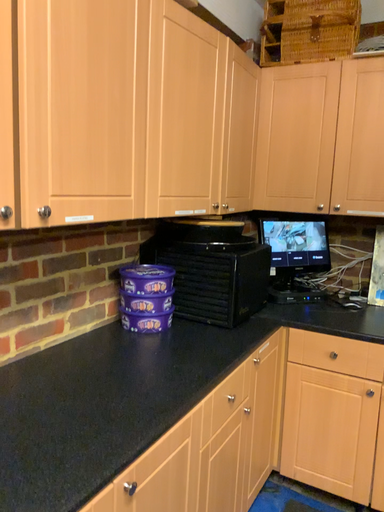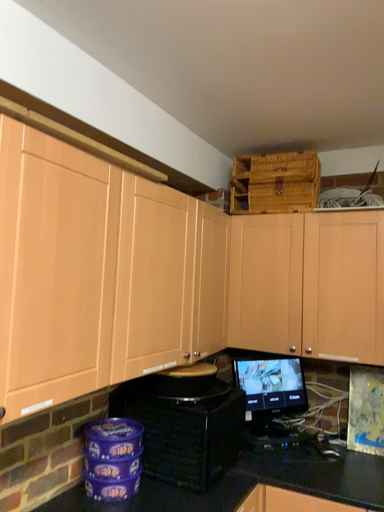
Question: Which way did the camera rotate in the video?

Choices:
 (A) rotated upward
 (B) rotated downward

Answer: (A)